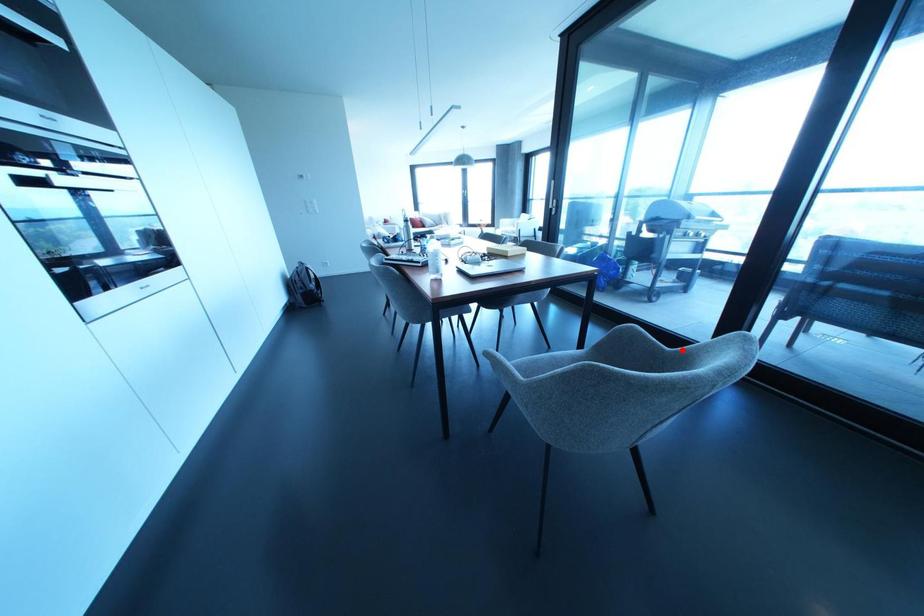
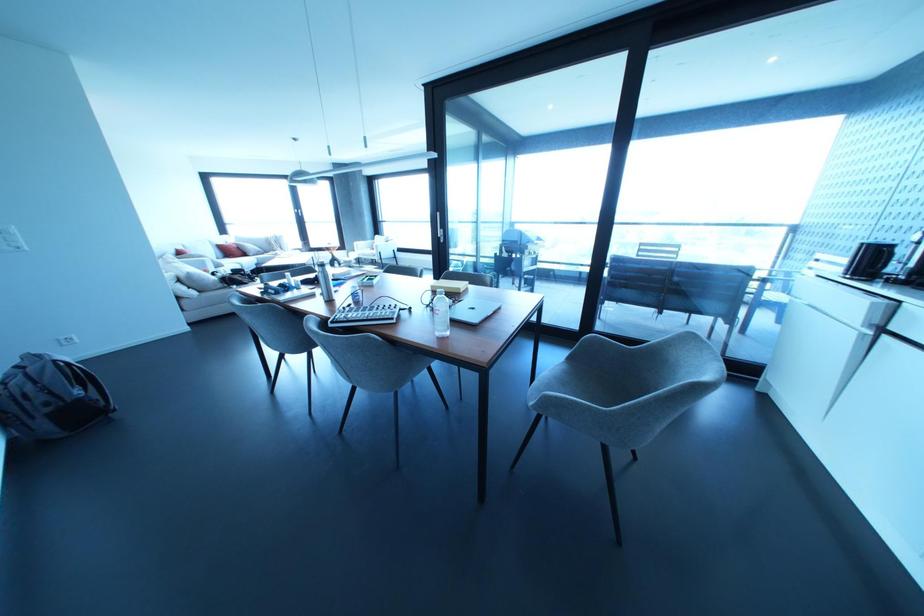
Find the pixel in the second image that matches the highlighted location in the first image.

(646, 346)